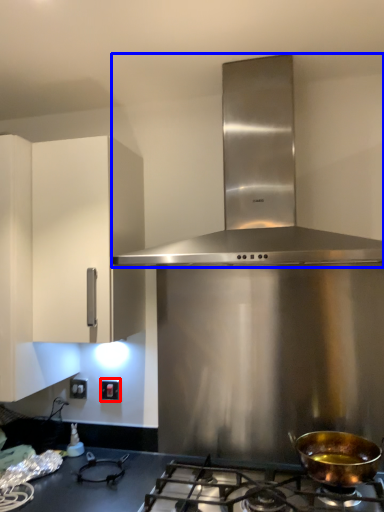
Question: Which of the following is the closest to the observer, electric outlet (highlighted by a red box) or home appliance (highlighted by a blue box)?

Choices:
 (A) electric outlet
 (B) home appliance

Answer: (B)